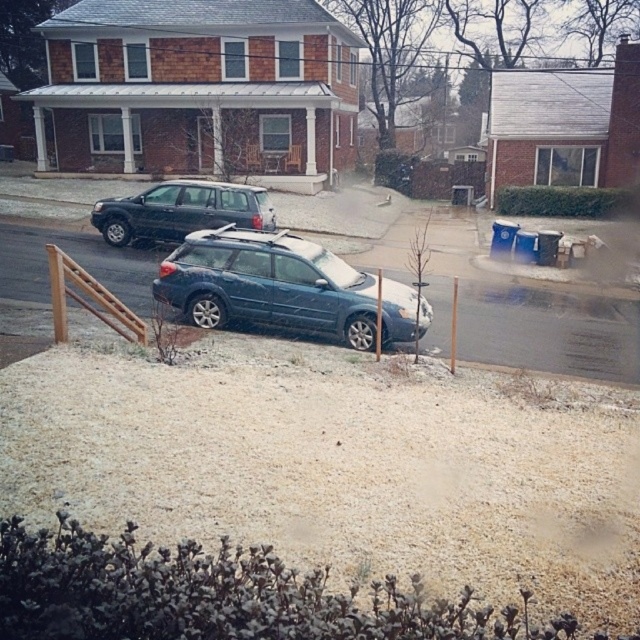
Can you confirm if satin blue station wagon at center is shorter than matte black suv at center?

No.

Who is taller, satin blue station wagon at center or matte black suv at center?

satin blue station wagon at center

Describe the element at coordinates (284, 288) in the screenshot. I see `satin blue station wagon at center` at that location.

Where is `satin blue station wagon at center`? This screenshot has height=640, width=640. satin blue station wagon at center is located at coordinates (284, 288).